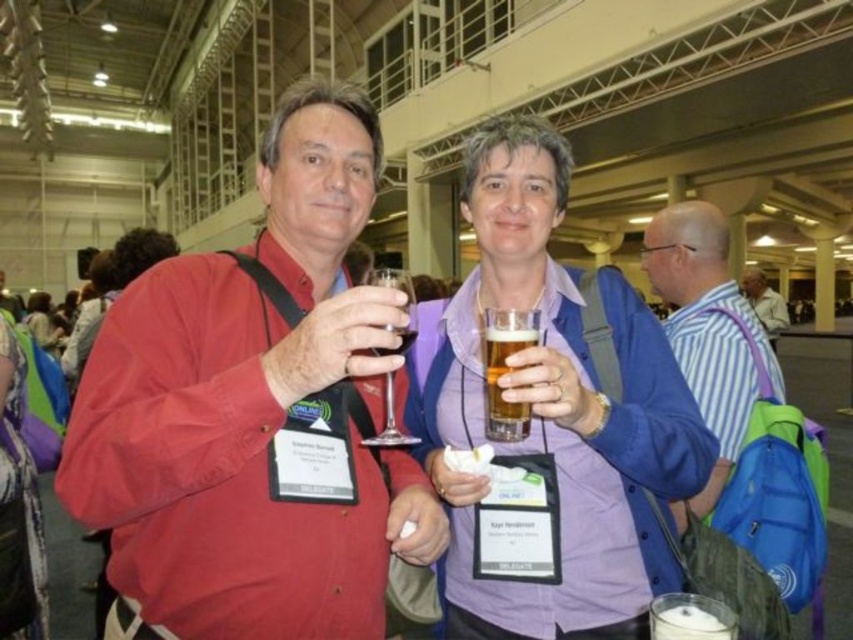
You are a photographer at the event and need to take a photo of both the matte red shirt at center and the clear glass wine at center. Which object will appear closer to the camera in the photo?

The matte red shirt at center will appear closer to the camera in the photo because it is positioned in front of the clear glass wine at center.

You are a photographer at the event and need to focus your camera on the matte red shirt at center and the clear glass wine at center. Which object should you adjust your focus to first if you want to capture both in a single shot without refocusing?

The matte red shirt at center is larger in size than the clear glass wine at center, so you should focus on the matte red shirt at center first as it is the larger object to ensure both are in focus.

Based on the coordinates provided, which object is located at point (254, 412)?

The point (254, 412) indicates the location of the matte red shirt at center.